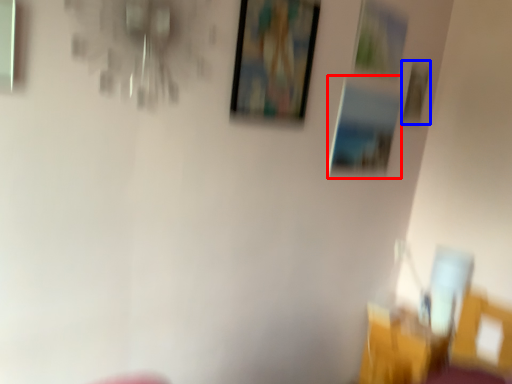
Question: Which point is further to the camera, picture frame (highlighted by a red box) or picture frame (highlighted by a blue box)?

Choices:
 (A) picture frame
 (B) picture frame

Answer: (B)